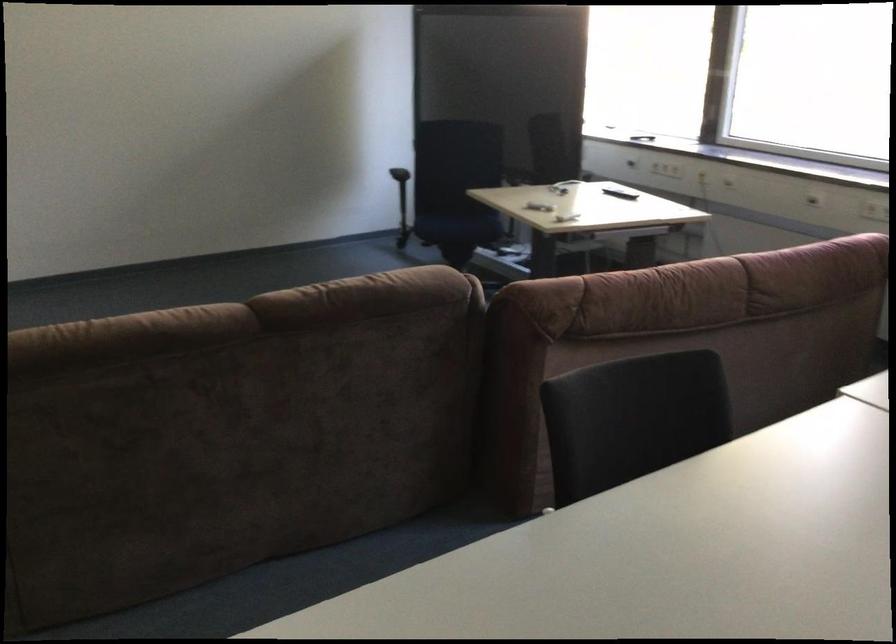
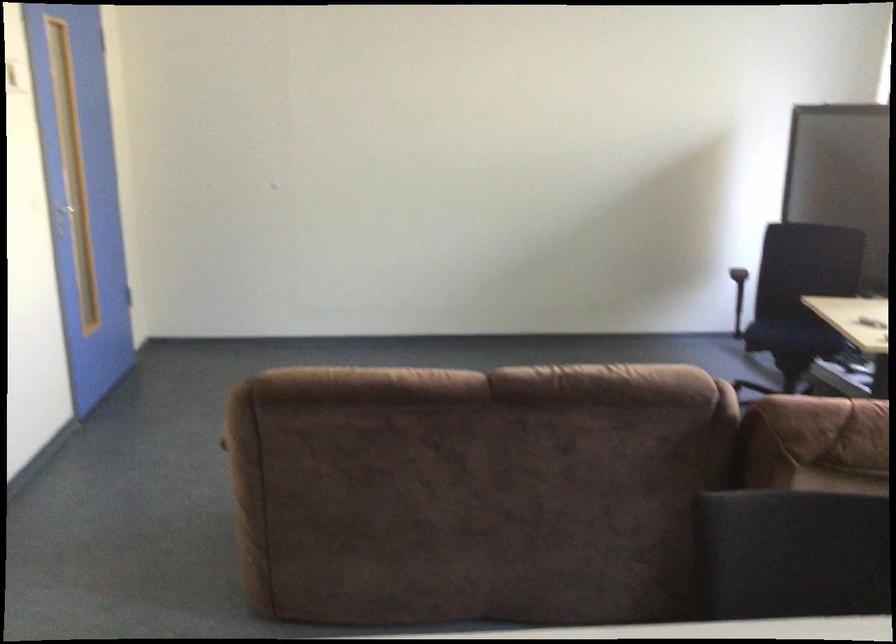
The point at (471, 227) is marked in the first image. Where is the corresponding point in the second image?

(793, 337)